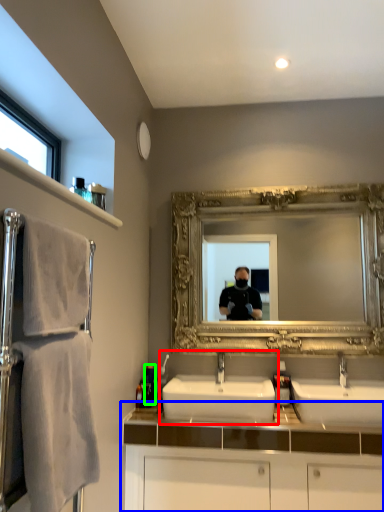
Question: Estimate the real-world distances between objects in this image. Which object is closer to sink (highlighted by a red box), bathroom cabinet (highlighted by a blue box) or toiletry (highlighted by a green box)?

Choices:
 (A) bathroom cabinet
 (B) toiletry

Answer: (A)